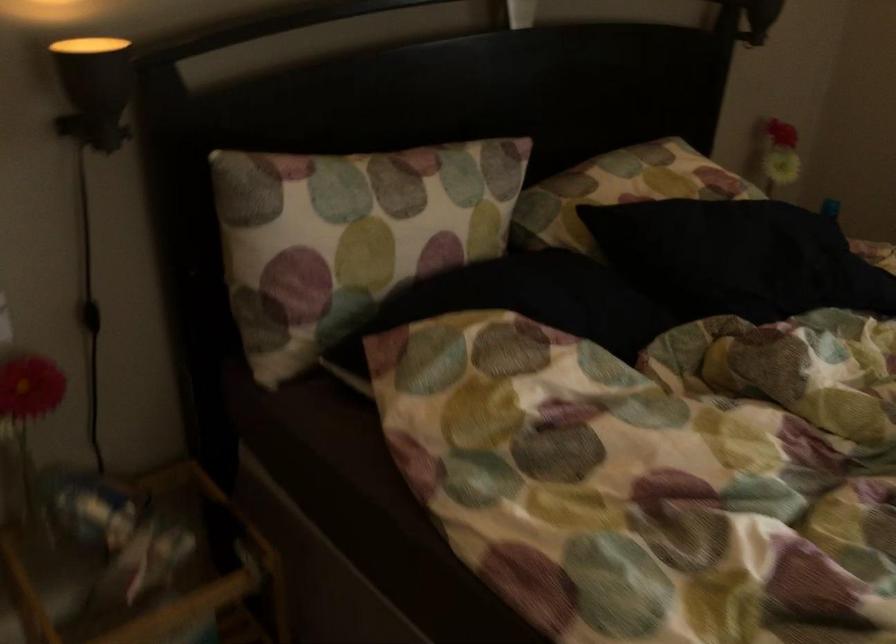
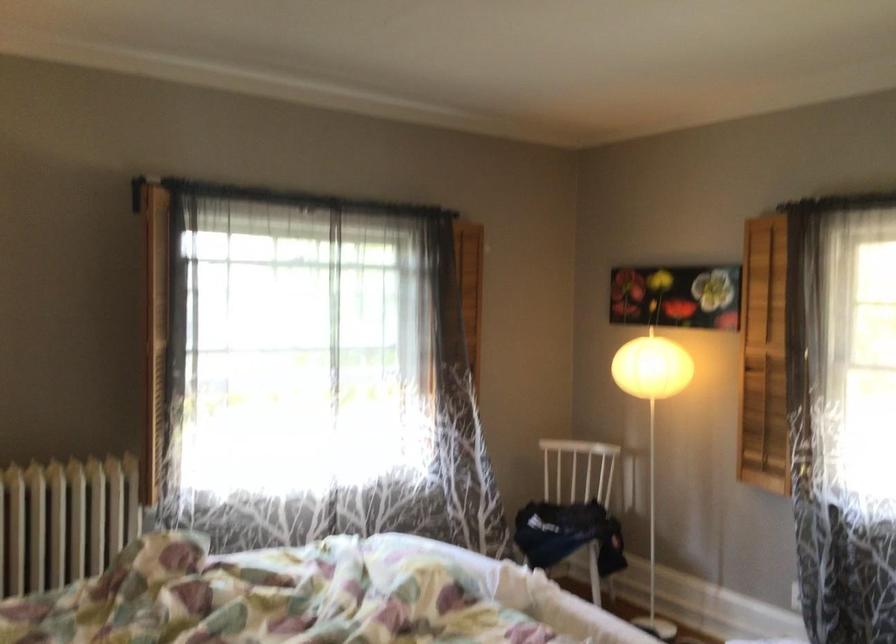
Question: The first image is from the beginning of the video and the second image is from the end. How did the camera likely rotate when shooting the video?

Choices:
 (A) Left
 (B) Right
 (C) Up
 (D) Down

Answer: (B)